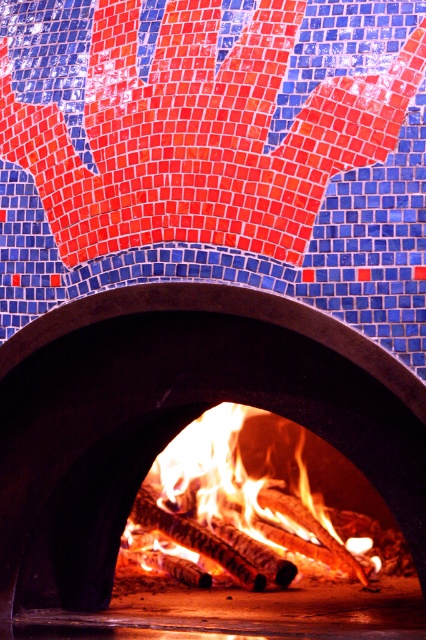
Question: Which object is farther from the camera taking this photo?

Choices:
 (A) flaming wood at center
 (B) blue mosaic tile at upper center
 (C) black stone oven at center

Answer: (A)

Question: Which point is closer to the camera?

Choices:
 (A) blue mosaic tile at upper center
 (B) flaming wood at center
 (C) black stone oven at center

Answer: (A)

Question: Does blue mosaic tile at upper center have a smaller size compared to flaming wood at center?

Choices:
 (A) yes
 (B) no

Answer: (B)

Question: Which point is farther to the camera?

Choices:
 (A) (46, 64)
 (B) (62, 512)

Answer: (B)

Question: Is black stone oven at center wider than flaming wood at center?

Choices:
 (A) no
 (B) yes

Answer: (B)

Question: Does black stone oven at center come behind flaming wood at center?

Choices:
 (A) no
 (B) yes

Answer: (A)